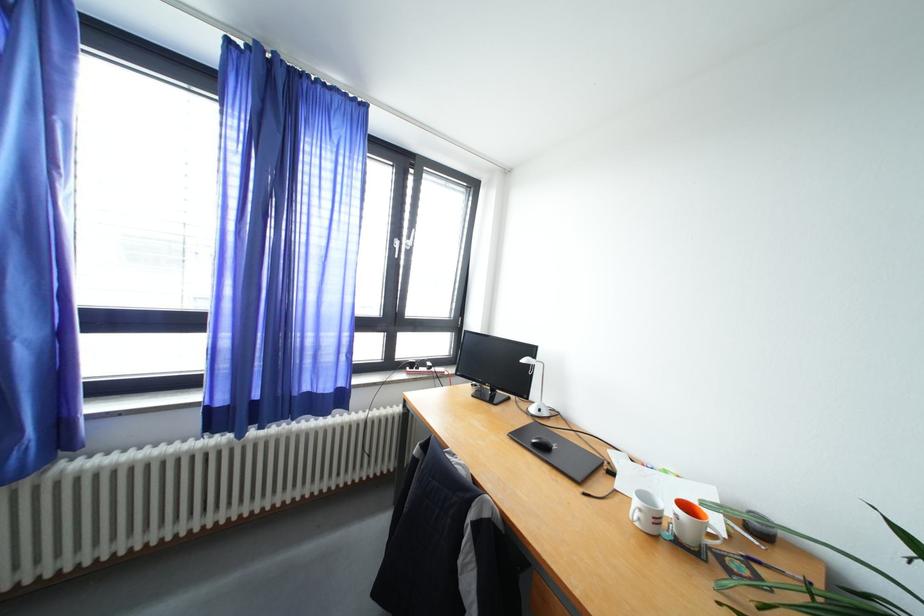
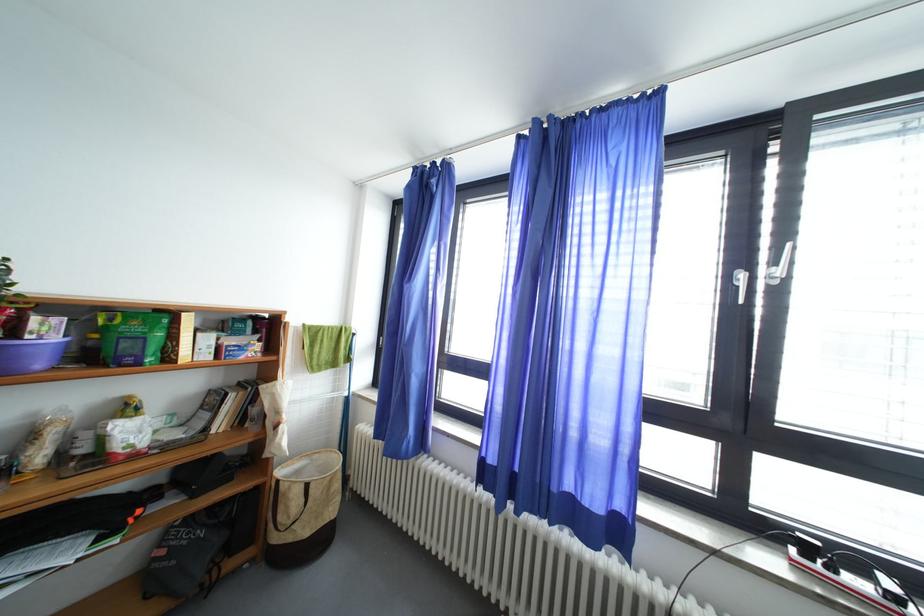
Question: The camera is either moving clockwise (left) or counter-clockwise (right) around the object. The first image is from the beginning of the video and the second image is from the end. Is the camera moving left or right when shooting the video?

Choices:
 (A) Left
 (B) Right

Answer: (B)